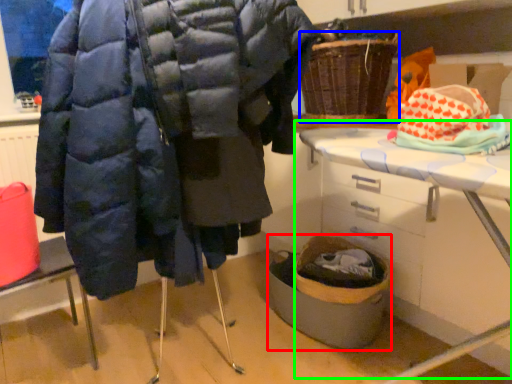
Question: Estimate the real-world distances between objects in this image. Which object is closer to basket container (highlighted by a red box), basket (highlighted by a blue box) or table (highlighted by a green box)?

Choices:
 (A) basket
 (B) table

Answer: (B)